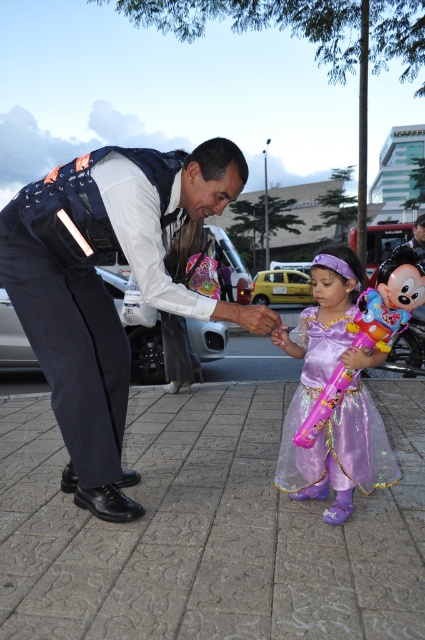
You are a photographer trying to capture the perfect shot of the purple iridescent dress at center and the shiny plastic balloon at center. Based on their positions, which object should you focus on first if you want to include both in your frame without moving the camera?

The purple iridescent dress at center is to the left of the shiny plastic balloon at center, so you should focus on the purple iridescent dress at center first to ensure both are in frame without moving the camera.

You are a photographer trying to capture a candid shot of the dark blue uniform at left and the purple iridescent dress at center. Since you want to ensure both subjects are in focus, you need to know their relative heights. Which one is taller?

The dark blue uniform at left is taller than the purple iridescent dress at center.

You are a photographer trying to capture a closeup shot of both the purple iridescent dress at center and the shiny plastic balloon at center. Since you want to focus on the details of both objects, which one should you zoom in on first to ensure the smaller object is in focus?

The purple iridescent dress at center has a lesser width compared to the shiny plastic balloon at center, so you should zoom in on the purple iridescent dress at center first to ensure the smaller object is in focus.